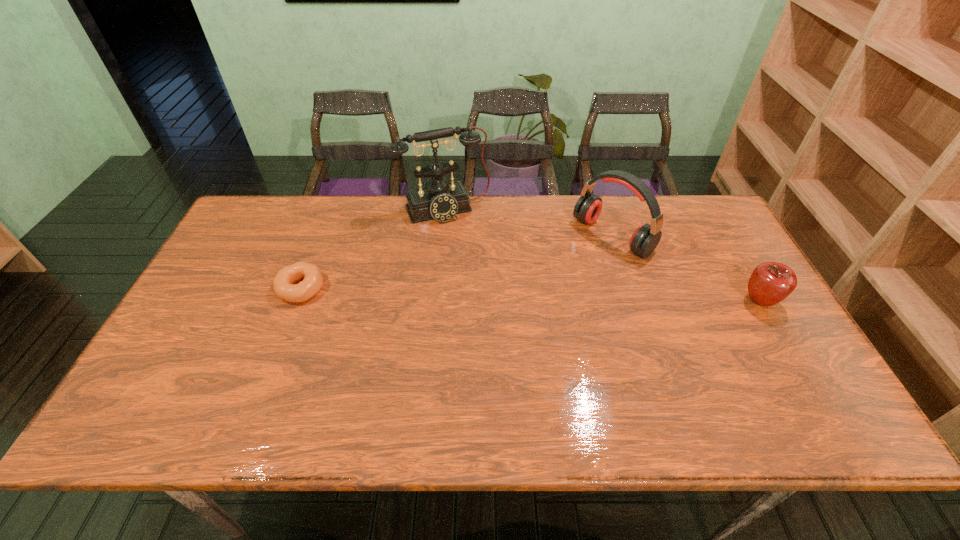
The width and height of the screenshot is (960, 540). I want to click on free space on the desktop that is between the doughnut and the rightmost object and is positioned on the ear cups of the earphone, so click(x=532, y=295).

This screenshot has height=540, width=960. Find the location of `free space on the desktop that is between the leftmost object and the apple and is positioned on the dial of the telephone`. free space on the desktop that is between the leftmost object and the apple and is positioned on the dial of the telephone is located at coordinates (486, 294).